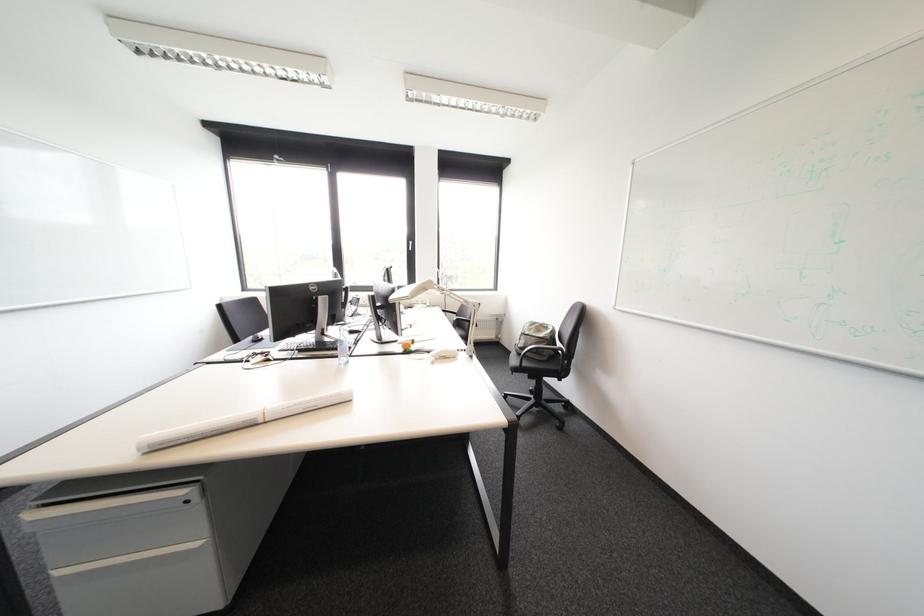
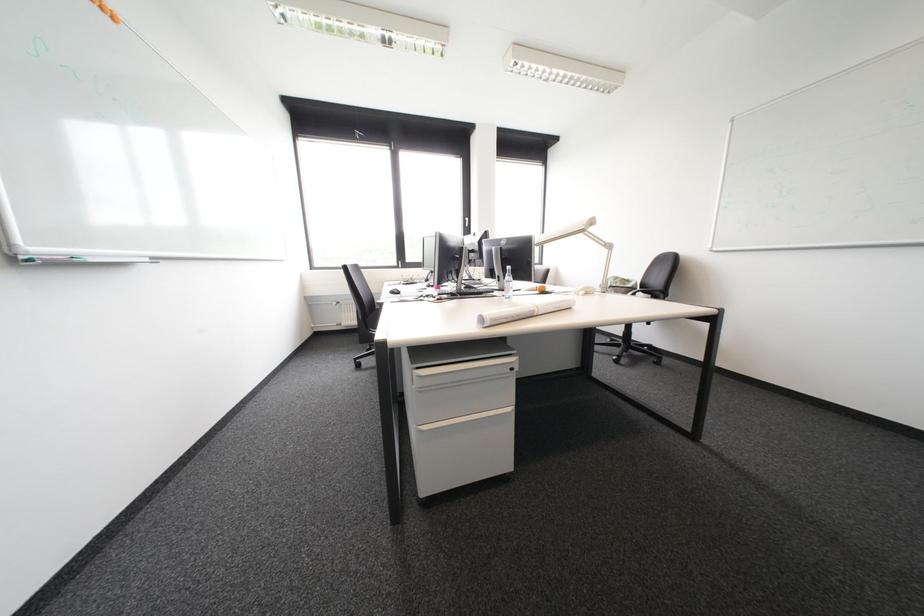
Find the pixel in the second image that matches [264,419] in the first image.

(543, 312)